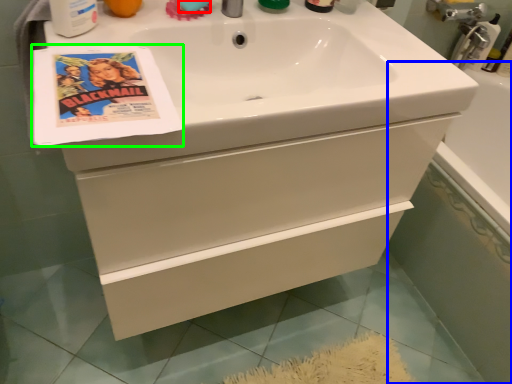
Question: Based on their relative distances, which object is nearer to soap (highlighted by a red box)? Choose from bath (highlighted by a blue box) and flyer (highlighted by a green box).

Choices:
 (A) bath
 (B) flyer

Answer: (B)